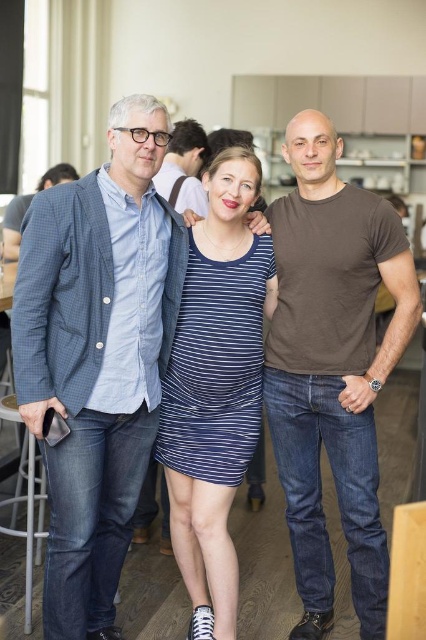
Question: Is brown cotton t-shirt at center wider than blue striped dress at center?

Choices:
 (A) no
 (B) yes

Answer: (B)

Question: Among these points, which one is nearest to the camera?

Choices:
 (A) (184, 134)
 (B) (330, 230)
 (C) (60, 234)
 (D) (29, 602)

Answer: (C)

Question: Can you confirm if matte blue jeans at center is positioned below metallic silver stool at lower left?

Choices:
 (A) yes
 (B) no

Answer: (B)

Question: From the image, what is the correct spatial relationship of blue striped dress at center in relation to metallic silver stool at lower left?

Choices:
 (A) left
 (B) right

Answer: (B)

Question: Which point is closer to the camera taking this photo?

Choices:
 (A) (189, 538)
 (B) (135, 170)
 (C) (178, 172)
 (D) (288, 280)

Answer: (B)

Question: Based on their relative distances, which object is nearer to the matte blue jeans at center?

Choices:
 (A) metallic silver stool at lower left
 (B) blue checkered blazer at left
 (C) brown cotton t-shirt at center

Answer: (C)